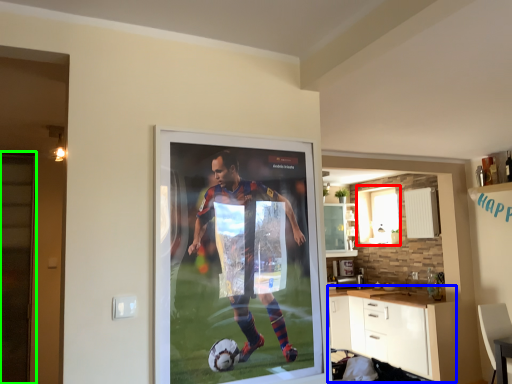
Question: Which object is positioned closest to window (highlighted by a red box)? Select from cabinetry (highlighted by a blue box) and screen door (highlighted by a green box).

Choices:
 (A) cabinetry
 (B) screen door

Answer: (A)